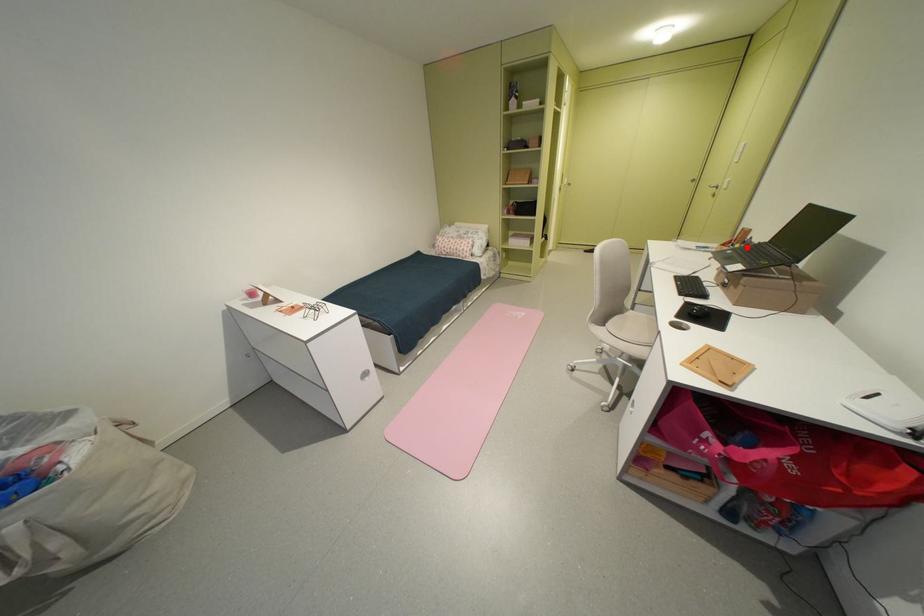
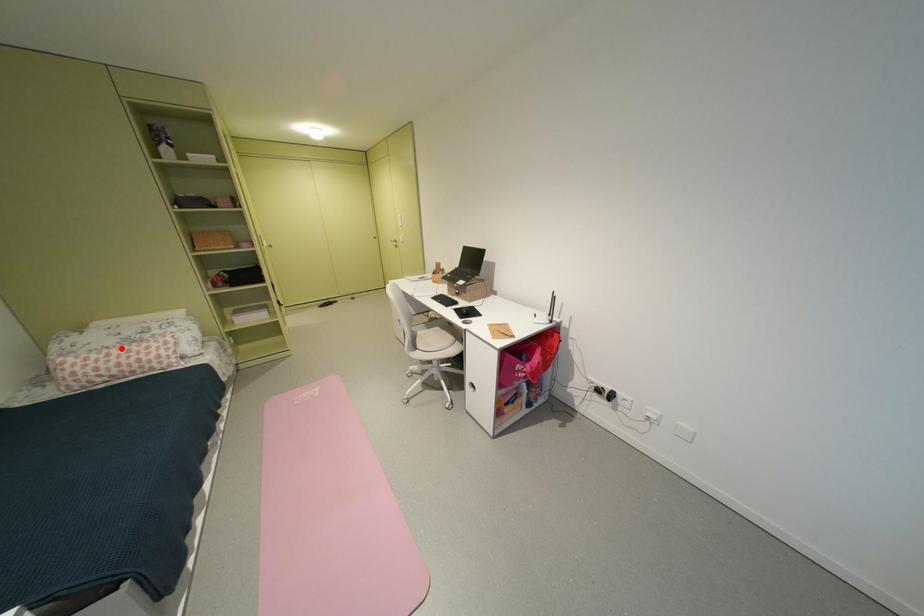
I am providing you with two images of the same scene from different viewpoints. A red point is marked on the first image and another point is marked on the second image. Is the marked point in image1 the same physical position as the marked point in image2?

No